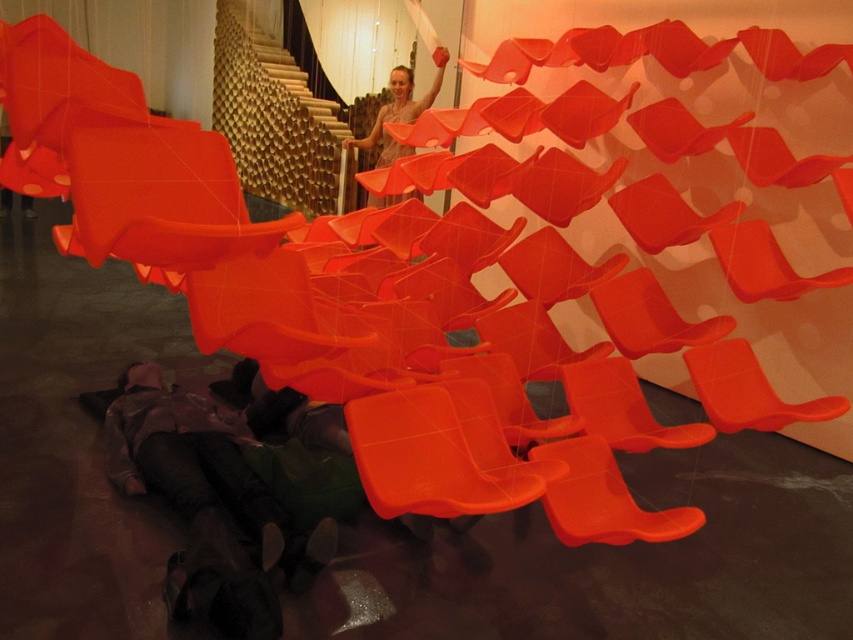
You are an interior designer planning to place a new rug in the space. The rug must accommodate both the dark brown leather boots at lower left and the matte plastic chair at center. Considering their widths, which object requires a wider area on the rug?

The dark brown leather boots at lower left requires a wider area on the rug since its width is larger than the matte plastic chair at center.

You are standing in the installation and want to move from the point at coordinates point (293, 568) to the point at coordinates point (387, 134). Since you can only move forward, will you pass in front of or behind the orange sculptural forms?

Since point (293, 568) is in front of point (387, 134), moving from the first point to the second would mean moving backward relative to the orange sculptural forms. Therefore, you would pass behind the orange sculptural forms.

You are an artist trying to install a new sculpture in the space. The sculpture requires a base that must be wider than the existing dark brown leather boots at lower left. Can the matte orange fabric at upper center serve as this base?

The dark brown leather boots at lower left might be wider than matte orange fabric at upper center, so it is uncertain if the matte orange fabric at upper center is wide enough to serve as the base.